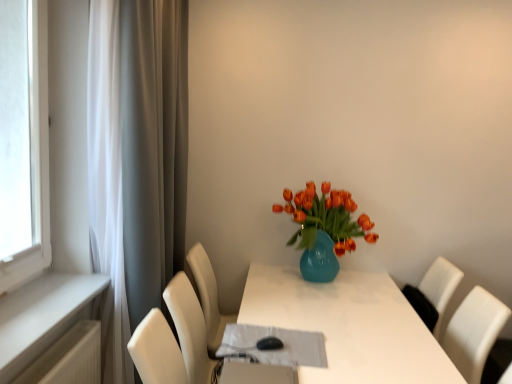
Question: Should I look upward or downward to see white painted wood at left?

Choices:
 (A) up
 (B) down

Answer: (B)

Question: Is matte blue vase with orange tulips at center positioned with its back to white painted wood at left?

Choices:
 (A) no
 (B) yes

Answer: (A)

Question: Is the position of matte blue vase with orange tulips at center more distant than that of white painted wood at left?

Choices:
 (A) yes
 (B) no

Answer: (A)

Question: Considering the relative positions of matte blue vase with orange tulips at center and white painted wood at left in the image provided, is matte blue vase with orange tulips at center to the left of white painted wood at left from the viewer's perspective?

Choices:
 (A) no
 (B) yes

Answer: (A)

Question: Considering the relative sizes of matte blue vase with orange tulips at center and white painted wood at left in the image provided, is matte blue vase with orange tulips at center taller than white painted wood at left?

Choices:
 (A) no
 (B) yes

Answer: (B)

Question: Is there a large distance between matte blue vase with orange tulips at center and white painted wood at left?

Choices:
 (A) no
 (B) yes

Answer: (B)

Question: Is matte blue vase with orange tulips at center shorter than white painted wood at left?

Choices:
 (A) no
 (B) yes

Answer: (A)

Question: Is white painted wood at left next to white glossy table at center and touching it?

Choices:
 (A) yes
 (B) no

Answer: (B)

Question: Are white painted wood at left and white glossy table at center located far from each other?

Choices:
 (A) no
 (B) yes

Answer: (B)

Question: Does white painted wood at left have a greater height compared to white glossy table at center?

Choices:
 (A) no
 (B) yes

Answer: (A)

Question: Does white painted wood at left have a lesser height compared to white glossy table at center?

Choices:
 (A) no
 (B) yes

Answer: (B)

Question: Considering the relative sizes of white painted wood at left and white glossy table at center in the image provided, is white painted wood at left wider than white glossy table at center?

Choices:
 (A) no
 (B) yes

Answer: (A)

Question: Is white painted wood at left not within white glossy table at center?

Choices:
 (A) yes
 (B) no

Answer: (A)

Question: Considering the relative sizes of white matte curtain at left and matte blue vase with orange tulips at center in the image provided, is white matte curtain at left shorter than matte blue vase with orange tulips at center?

Choices:
 (A) no
 (B) yes

Answer: (A)